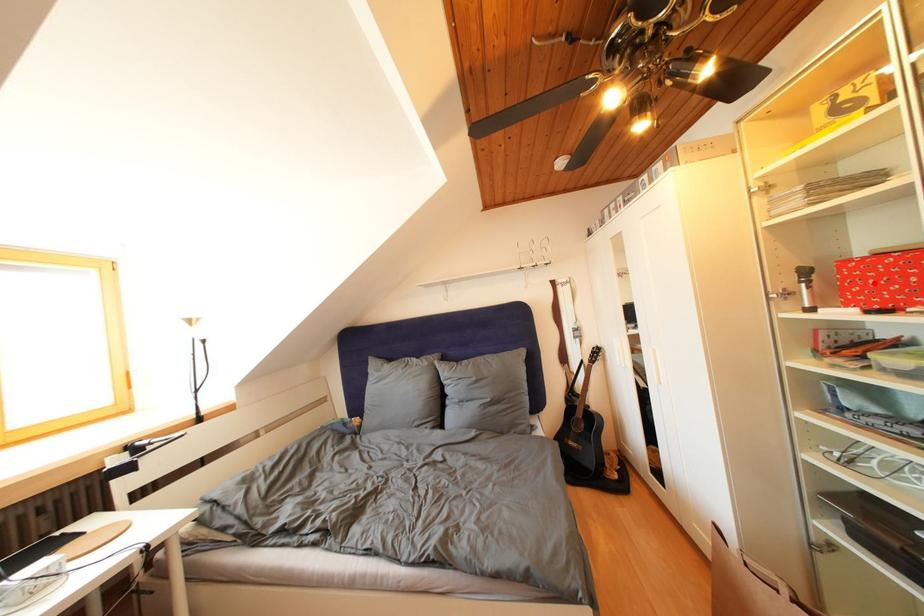
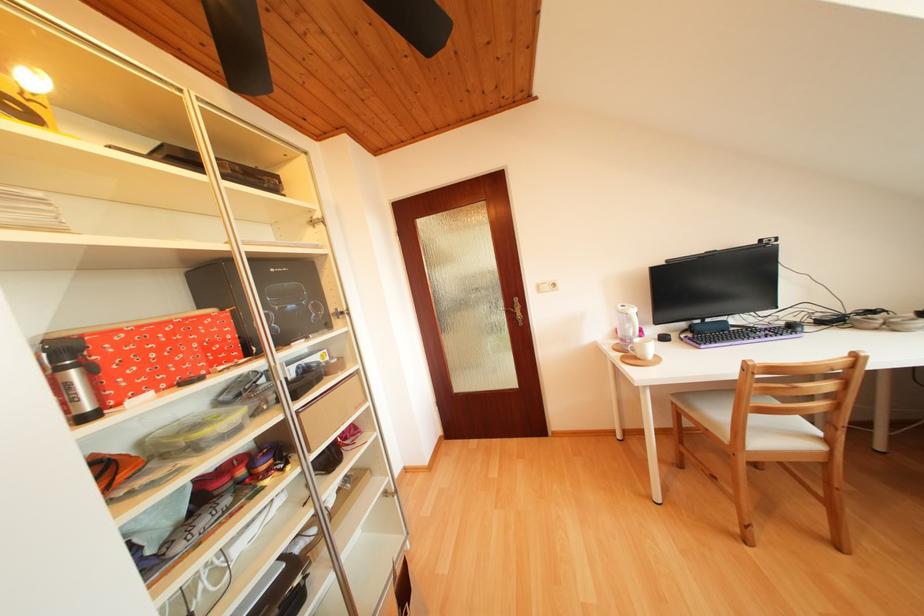
Locate, in the second image, the point that corresponds to the highlighted location in the first image.

(151, 358)